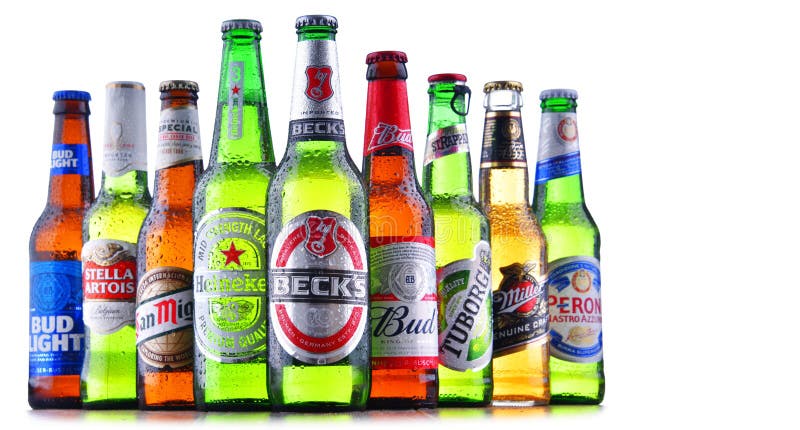
The height and width of the screenshot is (430, 800). What are the coordinates of `bottles` in the screenshot? It's located at (70, 210), (114, 211), (173, 217), (249, 217), (322, 227), (405, 230), (462, 237), (518, 239), (570, 252).